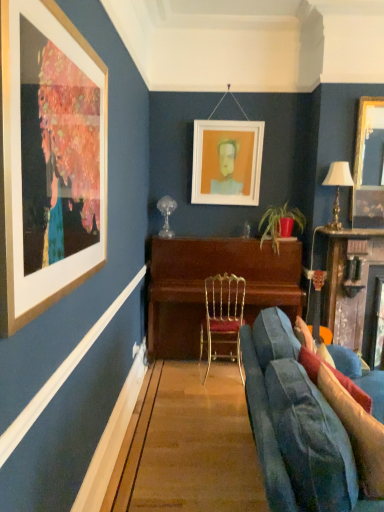
Locate an element on the screen. The height and width of the screenshot is (512, 384). vacant space underneath matte white picture frame at center, marked as the first picture frame in a left-to-right arrangement (from a real-world perspective) is located at coordinates (216, 233).